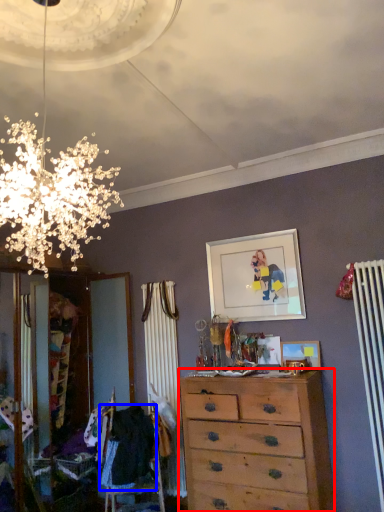
Question: Among these objects, which one is farthest to the camera, chest of drawers (highlighted by a red box) or clothing (highlighted by a blue box)?

Choices:
 (A) chest of drawers
 (B) clothing

Answer: (B)